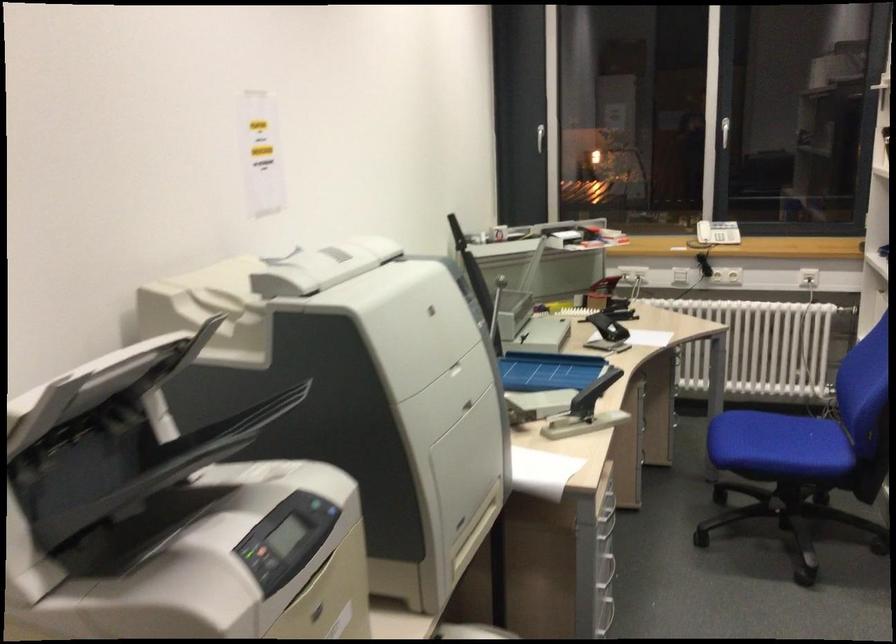
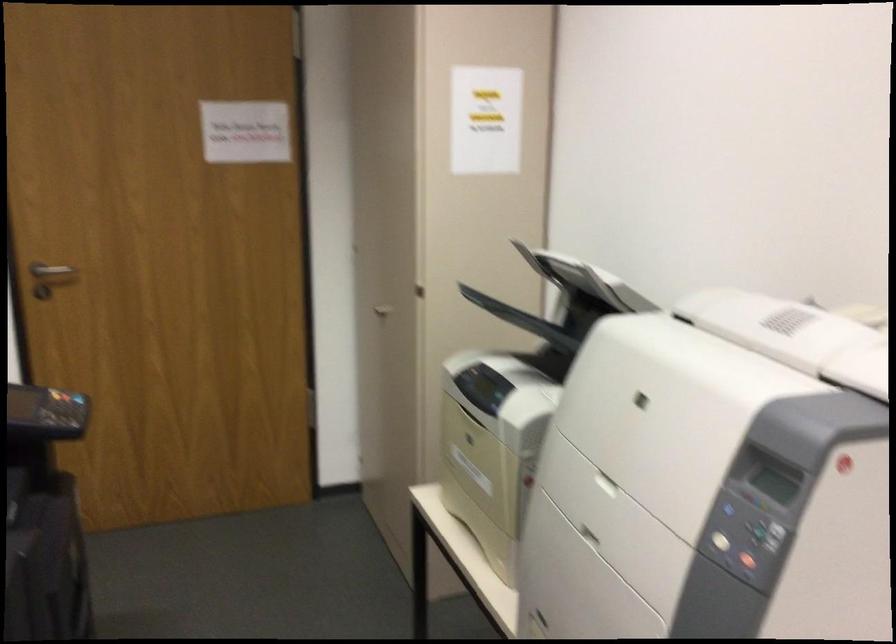
Locate, in the second image, the point that corresponds to [453,348] in the first image.

(717, 542)